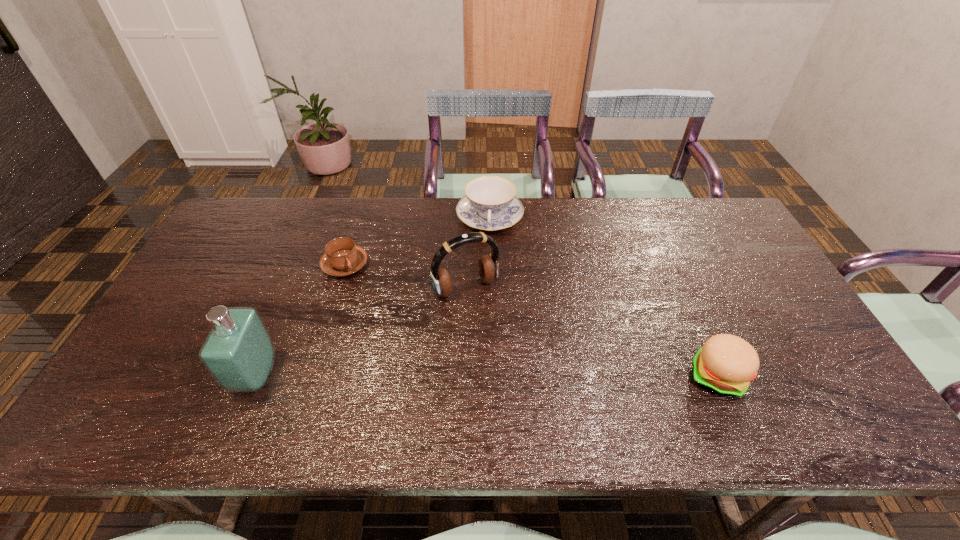
Find the location of a particular element. The height and width of the screenshot is (540, 960). free point between the fourth object from right to left and the headset is located at coordinates (405, 276).

This screenshot has height=540, width=960. In order to click on empty location between the second tallest object and the chinaware in this screenshot , I will do `click(478, 253)`.

You are a GUI agent. You are given a task and a screenshot of the screen. Output one action in this format:
    pyautogui.click(x=<x>, y=<y>)
    Task: Click on the free area in between the headset and the cappuccino
    
    Given the screenshot: What is the action you would take?
    pyautogui.click(x=405, y=276)

Where is `empty location between the cappuccino and the fourth shortest object`? The height and width of the screenshot is (540, 960). empty location between the cappuccino and the fourth shortest object is located at coordinates (405, 276).

The width and height of the screenshot is (960, 540). I want to click on free area in between the farthest object and the hamburger, so click(603, 297).

Image resolution: width=960 pixels, height=540 pixels. I want to click on vacant space that is in between the second tallest object and the perfume, so click(x=361, y=332).

You are a GUI agent. You are given a task and a screenshot of the screen. Output one action in this format:
    pyautogui.click(x=<x>, y=<y>)
    Task: Click on the free space between the fourth shortest object and the cappuccino
    The image size is (960, 540).
    Given the screenshot: What is the action you would take?
    pyautogui.click(x=405, y=276)

Image resolution: width=960 pixels, height=540 pixels. What are the coordinates of `vacant space in between the farthest object and the second tallest object` in the screenshot? It's located at (478, 253).

At what (x,y) coordinates should I click in order to perform the action: click on object identified as the third closest to the leftmost object. Please return your answer as a coordinate pair (x, y). Looking at the image, I should click on (x=490, y=204).

Where is `object that stands as the second closest to the second object from left to right`? The image size is (960, 540). object that stands as the second closest to the second object from left to right is located at coordinates (239, 353).